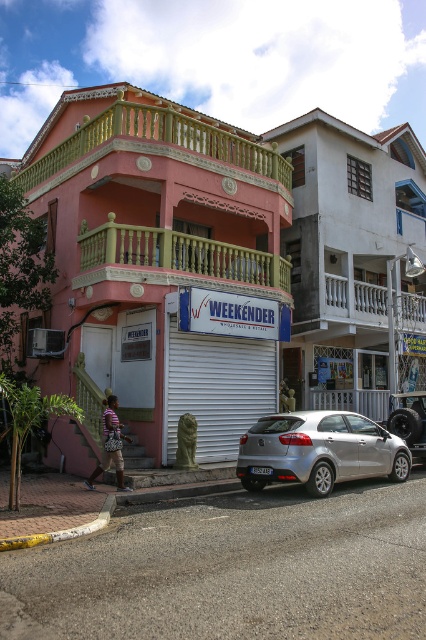
Between white matte signboard at center and silver metallic hatchback at center, which one has less height?

silver metallic hatchback at center is shorter.

Describe the element at coordinates (347, 253) in the screenshot. I see `white matte signboard at center` at that location.

This screenshot has width=426, height=640. Identify the location of white matte signboard at center. (347, 253).

Which of these two, matte pink building at center or striped fabric shirt at lower left, stands taller?

matte pink building at center

Who is positioned more to the left, matte pink building at center or striped fabric shirt at lower left?

striped fabric shirt at lower left

You are a GUI agent. You are given a task and a screenshot of the screen. Output one action in this format:
    pyautogui.click(x=<x>, y=<y>)
    Task: Click on the matte pink building at center
    This screenshot has width=426, height=640.
    Given the screenshot: What is the action you would take?
    pyautogui.click(x=161, y=262)

Is silver metallic hatchback at center taller than striped fabric shirt at lower left?

In fact, silver metallic hatchback at center may be shorter than striped fabric shirt at lower left.

Does silver metallic hatchback at center have a lesser height compared to striped fabric shirt at lower left?

A: Indeed, silver metallic hatchback at center has a lesser height compared to striped fabric shirt at lower left.

Who is more distant from viewer, (316, 438) or (109, 458)?

The point (109, 458) is more distant.

This screenshot has height=640, width=426. I want to click on silver metallic hatchback at center, so click(x=319, y=451).